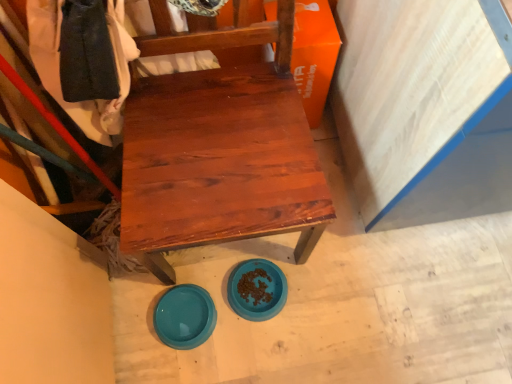
The width and height of the screenshot is (512, 384). Identify the location of free space underneath blue plastic bowl at lower center, marked as the 2th plate in a left-to-right arrangement (from a real-world perspective). (258, 297).